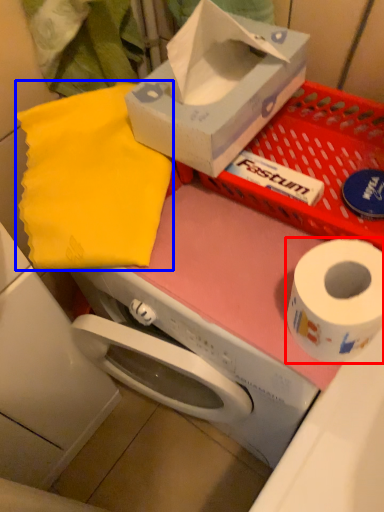
Question: Which object appears farthest to the camera in this image, toilet paper (highlighted by a red box) or cloth (highlighted by a blue box)?

Choices:
 (A) toilet paper
 (B) cloth

Answer: (B)